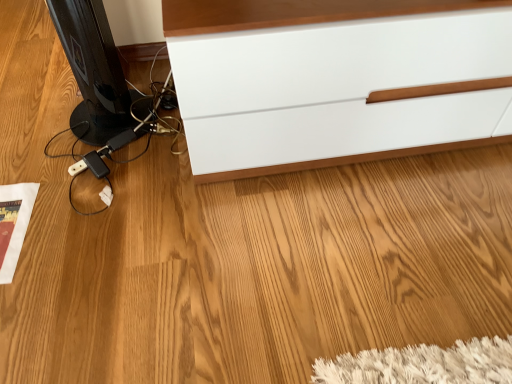
This screenshot has height=384, width=512. What are the coordinates of `vacant area that is in front of black glossy computer monitor at left` in the screenshot? It's located at (95, 183).